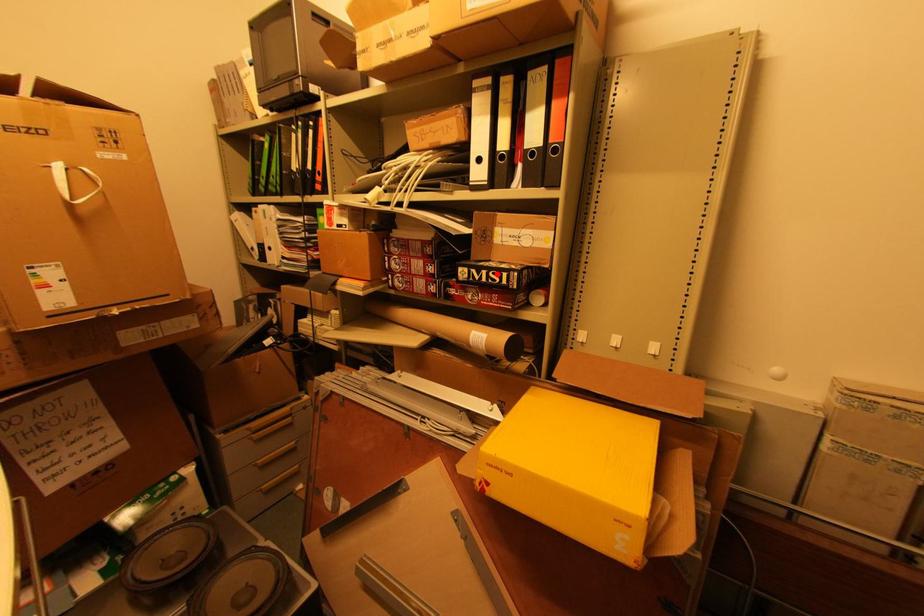
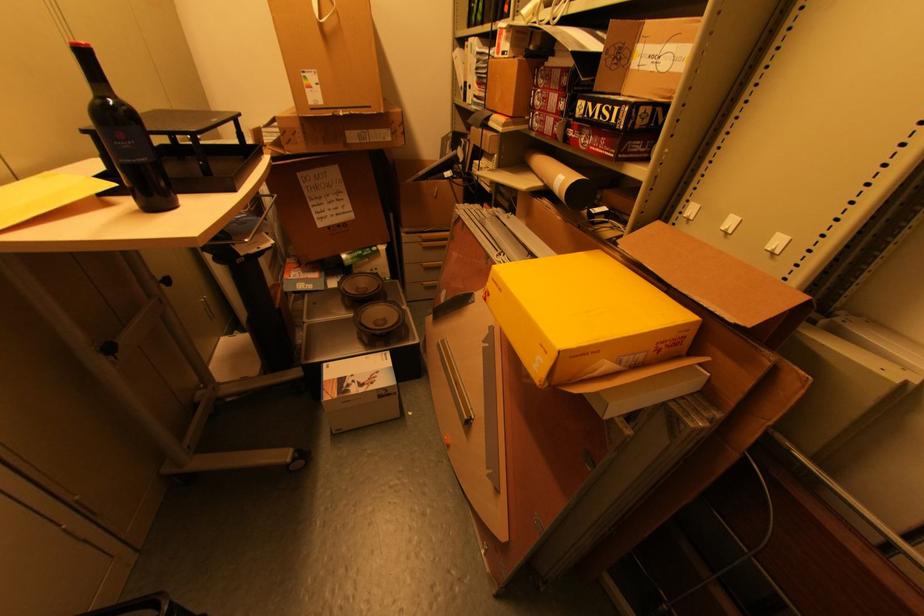
The point at the highlighted location is marked in the first image. Where is the corresponding point in the second image?

(610, 108)